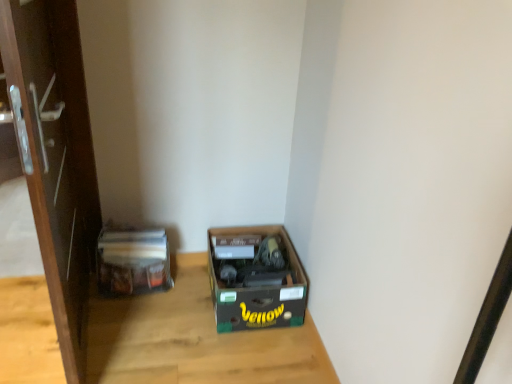
Question: Considering the relative sizes of brown glossy door at left and matte plastic bag at left in the image provided, is brown glossy door at left smaller than matte plastic bag at left?

Choices:
 (A) yes
 (B) no

Answer: (B)

Question: Considering the relative positions of brown glossy door at left and matte plastic bag at left in the image provided, is brown glossy door at left to the right of matte plastic bag at left from the viewer's perspective?

Choices:
 (A) yes
 (B) no

Answer: (B)

Question: Considering the relative sizes of brown glossy door at left and matte plastic bag at left in the image provided, is brown glossy door at left shorter than matte plastic bag at left?

Choices:
 (A) no
 (B) yes

Answer: (A)

Question: From a real-world perspective, does brown glossy door at left stand above matte plastic bag at left?

Choices:
 (A) no
 (B) yes

Answer: (B)

Question: Is the position of brown glossy door at left less distant than that of matte plastic bag at left?

Choices:
 (A) yes
 (B) no

Answer: (A)

Question: From the image's perspective, is brown cardboard box at lower center positioned above or below matte plastic bag at left?

Choices:
 (A) below
 (B) above

Answer: (A)

Question: Is point [x=244, y=271] closer or farther from the camera than point [x=114, y=228]?

Choices:
 (A) farther
 (B) closer

Answer: (B)

Question: Is brown cardboard box at lower center wider or thinner than matte plastic bag at left?

Choices:
 (A) thin
 (B) wide

Answer: (B)

Question: In the image, is brown cardboard box at lower center positioned in front of or behind matte plastic bag at left?

Choices:
 (A) front
 (B) behind

Answer: (A)

Question: Considering their positions, is matte plastic bag at left located in front of or behind brown cardboard box at lower center?

Choices:
 (A) front
 (B) behind

Answer: (B)

Question: Considering the positions of matte plastic bag at left and brown cardboard box at lower center in the image, is matte plastic bag at left wider or thinner than brown cardboard box at lower center?

Choices:
 (A) wide
 (B) thin

Answer: (B)

Question: From a real-world perspective, is matte plastic bag at left above or below brown cardboard box at lower center?

Choices:
 (A) above
 (B) below

Answer: (A)

Question: Is matte plastic bag at left situated inside brown cardboard box at lower center or outside?

Choices:
 (A) inside
 (B) outside

Answer: (B)

Question: In the image, is wooden table at center positioned in front of or behind brown cardboard box at lower center?

Choices:
 (A) front
 (B) behind

Answer: (A)

Question: Visually, is wooden table at center positioned to the left or to the right of brown cardboard box at lower center?

Choices:
 (A) right
 (B) left

Answer: (B)